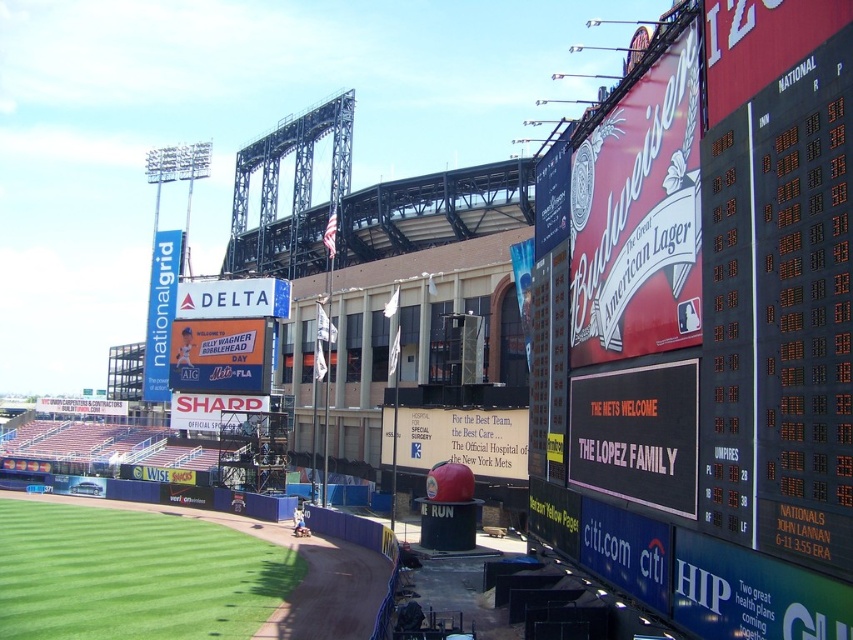
What do you see at coordinates (708, 346) in the screenshot? I see `black plastic scoreboard at upper right` at bounding box center [708, 346].

Describe the element at coordinates (708, 346) in the screenshot. I see `black plastic scoreboard at upper right` at that location.

Image resolution: width=853 pixels, height=640 pixels. Find the location of `black plastic scoreboard at upper right`. black plastic scoreboard at upper right is located at coordinates (708, 346).